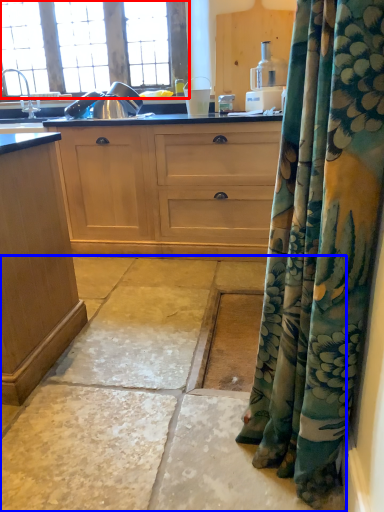
Question: Which object is closer to the camera taking this photo, window (highlighted by a red box) or concrete (highlighted by a blue box)?

Choices:
 (A) window
 (B) concrete

Answer: (B)